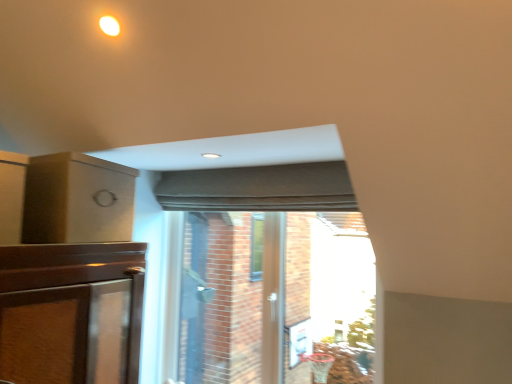
Question: Is matte gray curtain at center positioned in front of transparent glass door at center?

Choices:
 (A) yes
 (B) no

Answer: (B)

Question: Is the position of matte gray curtain at center more distant than that of transparent glass door at center?

Choices:
 (A) yes
 (B) no

Answer: (A)

Question: Is matte gray curtain at center next to transparent glass door at center?

Choices:
 (A) no
 (B) yes

Answer: (A)

Question: Can transparent glass door at center be found inside matte gray curtain at center?

Choices:
 (A) no
 (B) yes

Answer: (A)

Question: Considering the relative sizes of matte gray curtain at center and transparent glass door at center in the image provided, is matte gray curtain at center wider than transparent glass door at center?

Choices:
 (A) no
 (B) yes

Answer: (A)

Question: Does matte gray curtain at center have a greater height compared to transparent glass door at center?

Choices:
 (A) yes
 (B) no

Answer: (B)

Question: Is matte gray curtain at center located within transparent glass door at center?

Choices:
 (A) yes
 (B) no

Answer: (B)

Question: Is the depth of transparent glass door at center greater than that of matte gray curtain at center?

Choices:
 (A) yes
 (B) no

Answer: (B)

Question: Is transparent glass door at center aimed at matte gray curtain at center?

Choices:
 (A) yes
 (B) no

Answer: (B)

Question: Considering the relative sizes of transparent glass door at center and matte gray curtain at center in the image provided, is transparent glass door at center thinner than matte gray curtain at center?

Choices:
 (A) yes
 (B) no

Answer: (B)

Question: Is transparent glass door at center to the left of matte gray curtain at center from the viewer's perspective?

Choices:
 (A) yes
 (B) no

Answer: (B)

Question: Is transparent glass door at center oriented away from matte gray curtain at center?

Choices:
 (A) yes
 (B) no

Answer: (B)

Question: From the image's perspective, is transparent glass door at center above matte brown box at upper left?

Choices:
 (A) yes
 (B) no

Answer: (B)